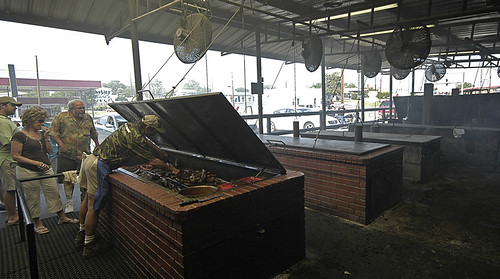
At what (x,y) coordinates should I click in order to perform the action: click on fans. Please return your answer as a coordinate pair (x, y). Image resolution: width=500 pixels, height=279 pixels. Looking at the image, I should click on pos(195,32), pos(314,51), pos(396,50), pos(374,64), pos(399,70), pos(428,69).